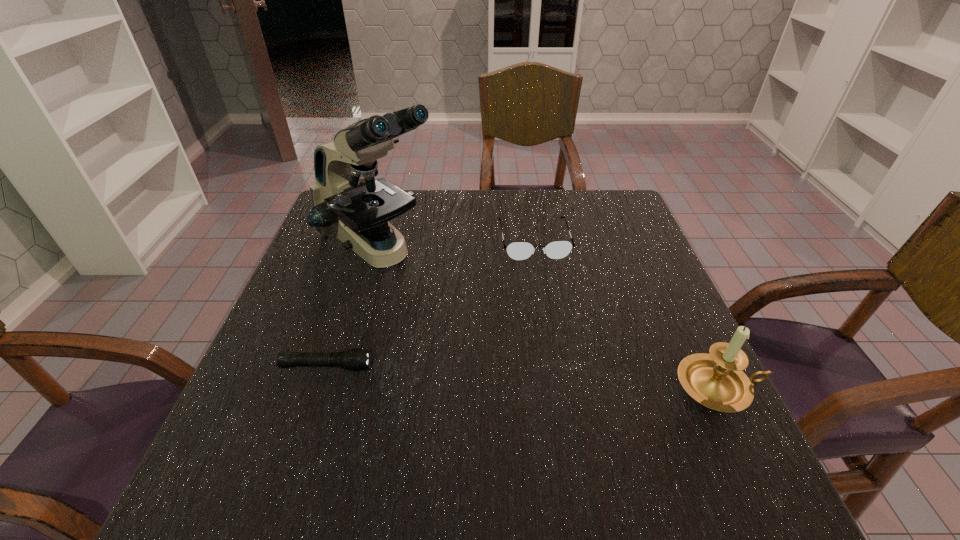
Find the location of a particular element. The height and width of the screenshot is (540, 960). object present at the near right corner is located at coordinates (716, 380).

This screenshot has width=960, height=540. I want to click on vacant space at the far edge of the desktop, so click(439, 193).

In the image, there is a desktop. Identify the location of vacant region at the near edge. (369, 404).

Locate an element on the screen. free spot at the left edge of the desktop is located at coordinates (320, 238).

Locate an element on the screen. Image resolution: width=960 pixels, height=540 pixels. vacant space at the right edge is located at coordinates 622,299.

Where is `vacant region at the near left corner of the desktop`? vacant region at the near left corner of the desktop is located at coordinates (318, 416).

Find the location of `free space at the far right corner`. free space at the far right corner is located at coordinates (617, 191).

In the image, there is a desktop. Where is `free space at the near right corner`? The height and width of the screenshot is (540, 960). free space at the near right corner is located at coordinates (646, 432).

Where is `free space between the shortest object and the candle holder`? free space between the shortest object and the candle holder is located at coordinates tap(523, 376).

Where is `unoccupied position between the third shortest object and the spectacles`? This screenshot has width=960, height=540. unoccupied position between the third shortest object and the spectacles is located at coordinates (626, 313).